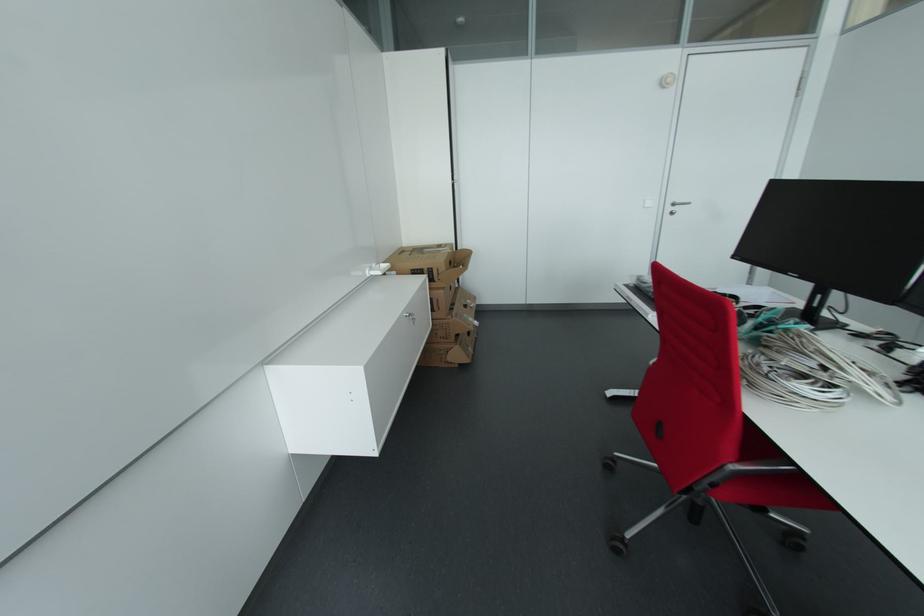
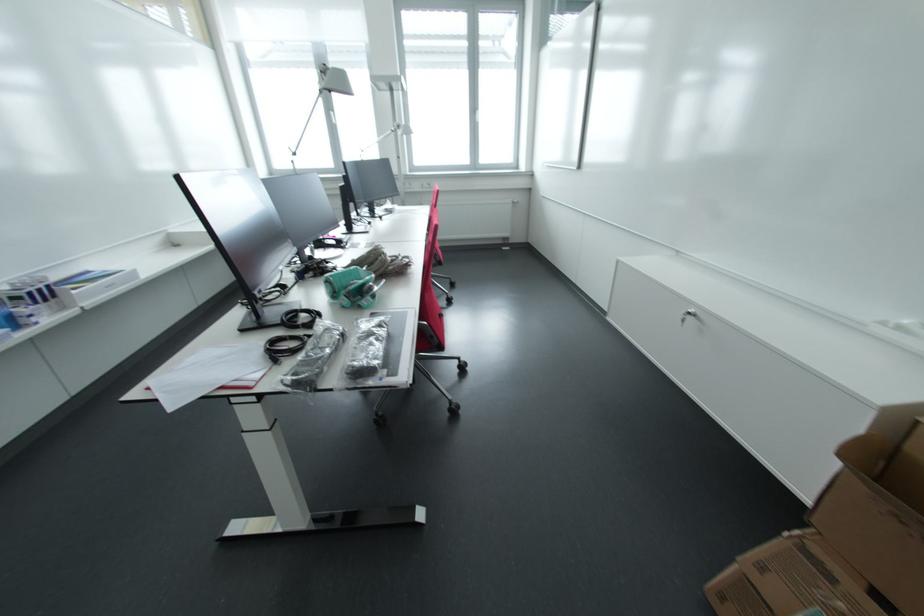
In the second image, find the point that corresponds to [459,315] in the first image.

(833, 578)